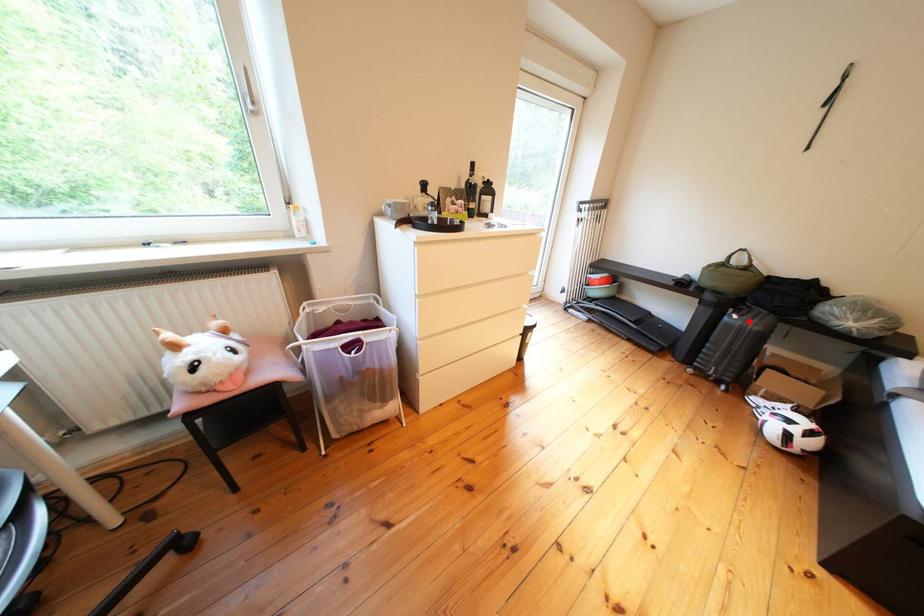
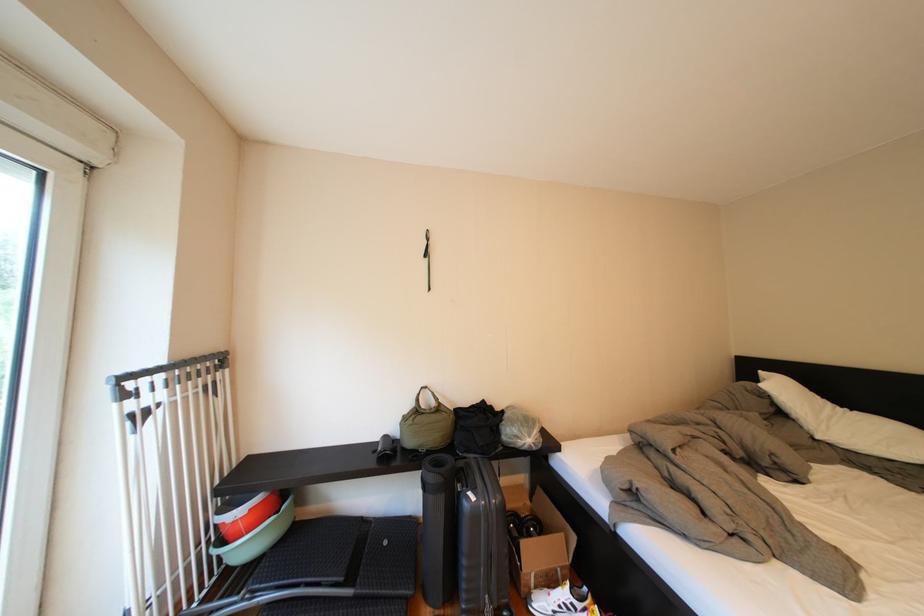
Locate, in the second image, the point that corresponds to the highlighted location in the first image.

(487, 503)